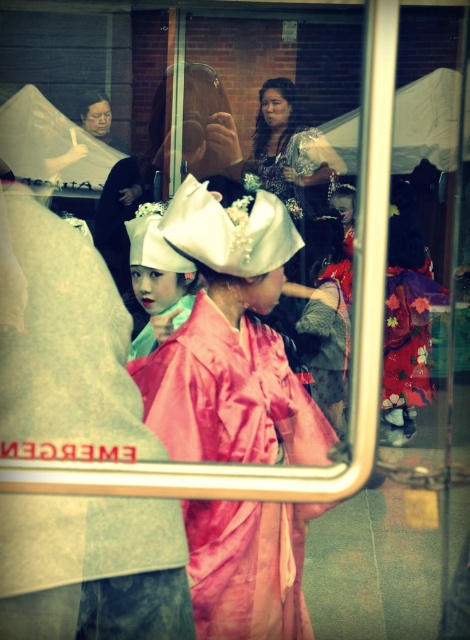
Describe the element at coordinates (230, 339) in the screenshot. The image size is (470, 640). I see `satin pink kimono at center` at that location.

Who is taller, satin pink kimono at center or matte floral dress at center?

satin pink kimono at center

Which is behind, point (234, 561) or point (290, 134)?

The point (290, 134) is behind.

You are a GUI agent. You are given a task and a screenshot of the screen. Output one action in this format:
    pyautogui.click(x=<x>, y=<y>)
    Task: Click on the satin pink kimono at center
    The height and width of the screenshot is (640, 470).
    Given the screenshot: What is the action you would take?
    pyautogui.click(x=230, y=339)

Is matte floral dress at center wider than white satin hat at center?

Yes.

Where is `matte floral dress at center`? The height and width of the screenshot is (640, 470). matte floral dress at center is located at coordinates click(289, 150).

How far apart are pink satin kimono at center and matte floral dress at center?

The distance of pink satin kimono at center from matte floral dress at center is 67.32 centimeters.

Who is positioned more to the right, pink satin kimono at center or matte floral dress at center?

matte floral dress at center

Consider the image. Who is more forward, (52, 362) or (308, 188)?

Point (52, 362) is in front.

This screenshot has height=640, width=470. I want to click on pink satin kimono at center, so (62, 342).